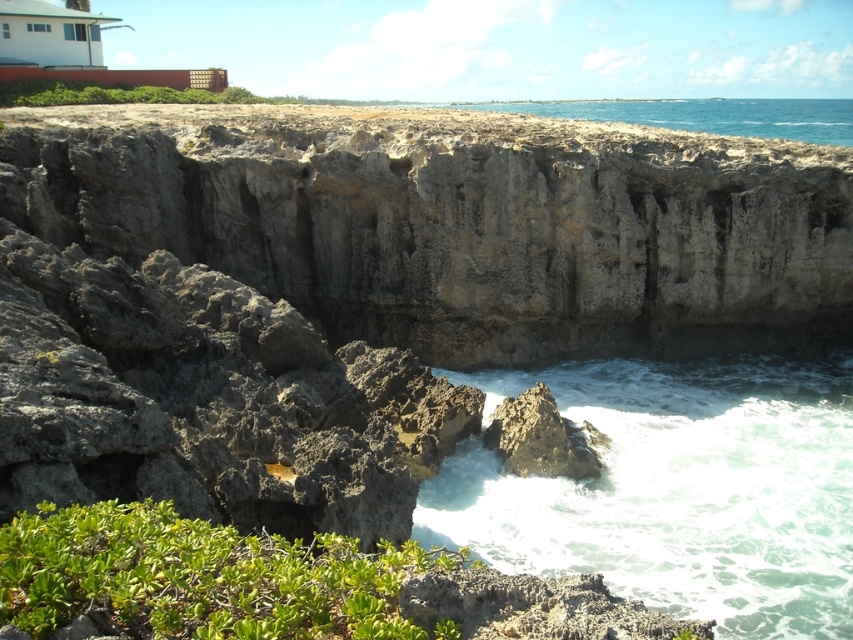
You are standing on the cliff edge looking out at the blue water at upper center and the rough textured rock at lower center. Which object is closer to your eyes?

The blue water at upper center is closer to your eyes because it is further to the viewer than the rough textured rock at lower center.

You are standing on the cliff edge looking at the blue water at upper center. If you want to jump into the water, would you be able to reach it from here?

The blue water at upper center is 290.60 feet away from the viewer, so jumping from the cliff edge would not reach it as the distance is too far.